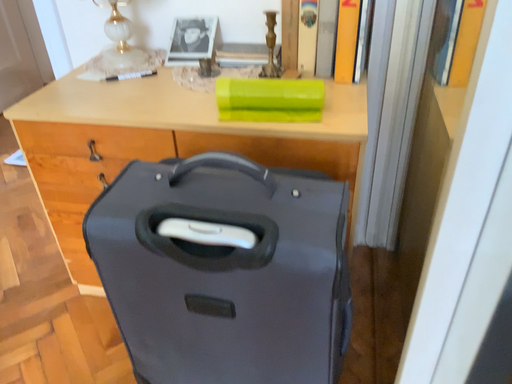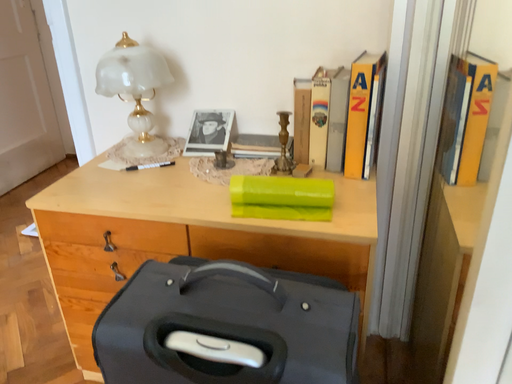
Question: Which way did the camera rotate in the video?

Choices:
 (A) rotated upward
 (B) rotated downward

Answer: (A)